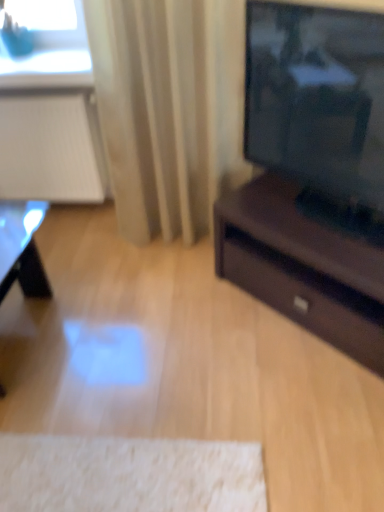
Question: From the image's perspective, relative to blue matte glass at upper left, is shiny black table at lower left above or below?

Choices:
 (A) below
 (B) above

Answer: (A)

Question: From a real-world perspective, is shiny black table at lower left positioned above or below blue matte glass at upper left?

Choices:
 (A) below
 (B) above

Answer: (A)

Question: Estimate the real-world distances between objects in this image. Which object is farther from the blue matte glass at upper left?

Choices:
 (A) beige fabric curtain at center
 (B) shiny black table at lower left

Answer: (B)

Question: Estimate the real-world distances between objects in this image. Which object is closer to the shiny black table at lower left?

Choices:
 (A) beige fabric curtain at center
 (B) blue matte glass at upper left

Answer: (A)